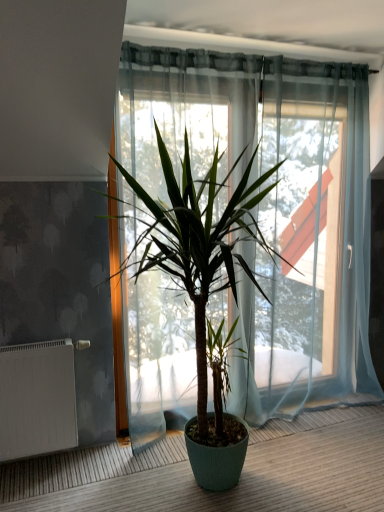
This screenshot has width=384, height=512. Find the location of `spots to the right of green matte plant at center`. spots to the right of green matte plant at center is located at coordinates (328, 458).